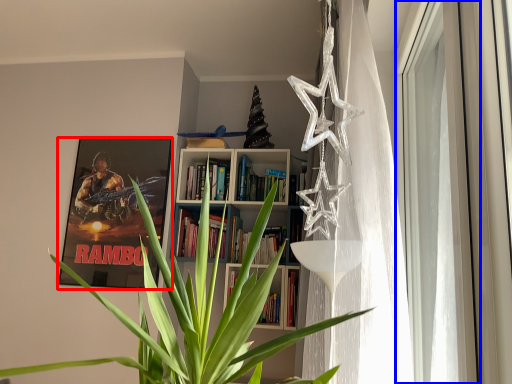
Question: Which point is closer to the camera, picture frame (highlighted by a red box) or window (highlighted by a blue box)?

Choices:
 (A) picture frame
 (B) window

Answer: (B)